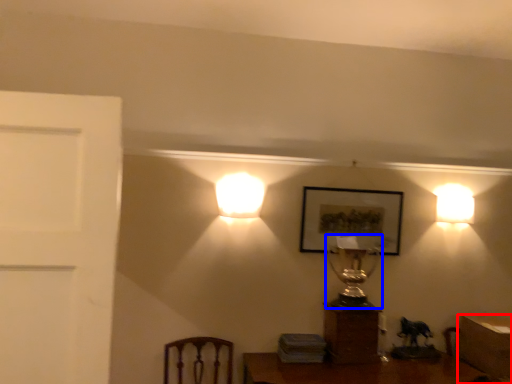
Question: Which point is closer to the camera, table (highlighted by a red box) or table lamp (highlighted by a blue box)?

Choices:
 (A) table
 (B) table lamp

Answer: (A)